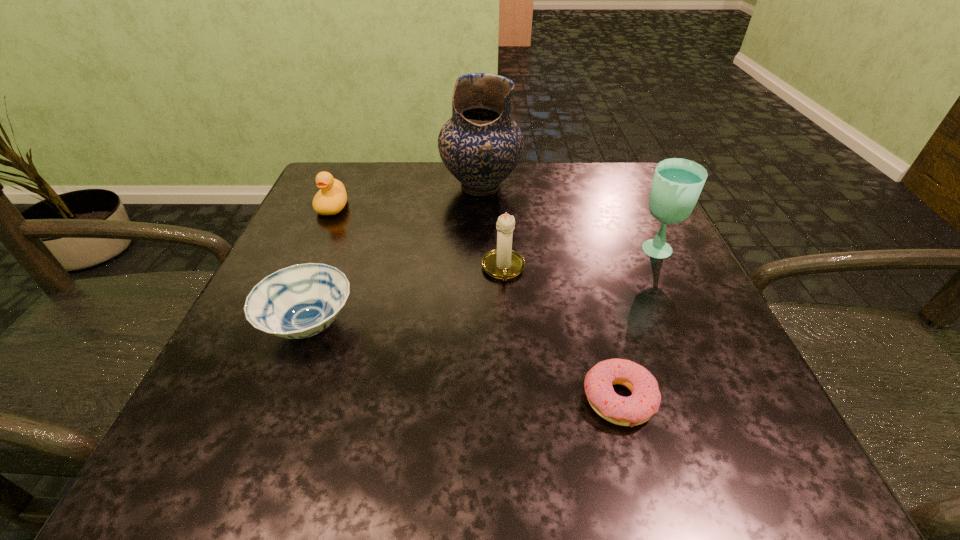
Locate an element on the screen. This screenshot has width=960, height=540. free space at the far right corner of the desktop is located at coordinates (600, 190).

Locate an element on the screen. The image size is (960, 540). free space between the fourth shortest object and the second nearest object is located at coordinates (406, 298).

Find the location of `free space between the duck and the nearest object`. free space between the duck and the nearest object is located at coordinates (476, 303).

Find the location of a particular element. vacant area that lies between the tallest object and the soup bowl is located at coordinates (396, 256).

The width and height of the screenshot is (960, 540). In order to click on vacant region between the duck and the shortest object in this screenshot , I will do coord(476,303).

Where is `empty space that is in between the pottery and the shortest object`? Image resolution: width=960 pixels, height=540 pixels. empty space that is in between the pottery and the shortest object is located at coordinates (550, 293).

Where is `free spot between the tallest object and the duck`? The height and width of the screenshot is (540, 960). free spot between the tallest object and the duck is located at coordinates (407, 197).

Locate an element on the screen. This screenshot has width=960, height=540. empty space between the candle holder and the second nearest object is located at coordinates (406, 298).

This screenshot has height=540, width=960. In order to click on vacant space in between the doughnut and the fifth farthest object in this screenshot , I will do `click(464, 363)`.

This screenshot has width=960, height=540. I want to click on blank region between the nearest object and the rightmost object, so click(636, 326).